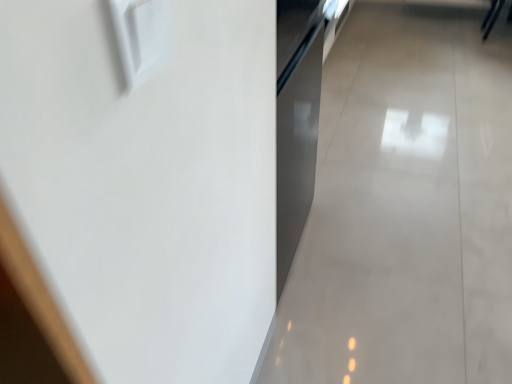
In order to click on white glossy wall at upper left in this screenshot , I will do pyautogui.click(x=406, y=208).

The image size is (512, 384). Describe the element at coordinates (406, 208) in the screenshot. I see `white glossy wall at upper left` at that location.

At what (x,y) coordinates should I click in order to perform the action: click on white glossy wall at upper left. Please return your answer as a coordinate pair (x, y). The height and width of the screenshot is (384, 512). Looking at the image, I should click on (406, 208).